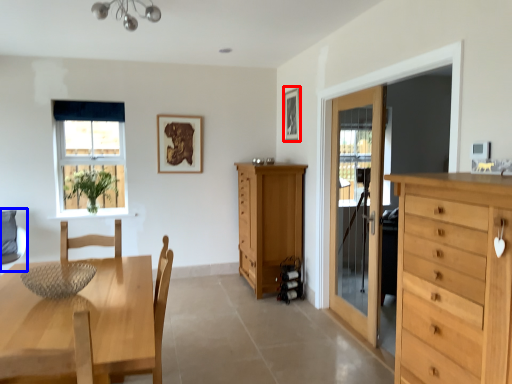
Question: Which of the following is the farthest to the observer, picture frame (highlighted by a red box) or swivel chair (highlighted by a blue box)?

Choices:
 (A) picture frame
 (B) swivel chair

Answer: (A)